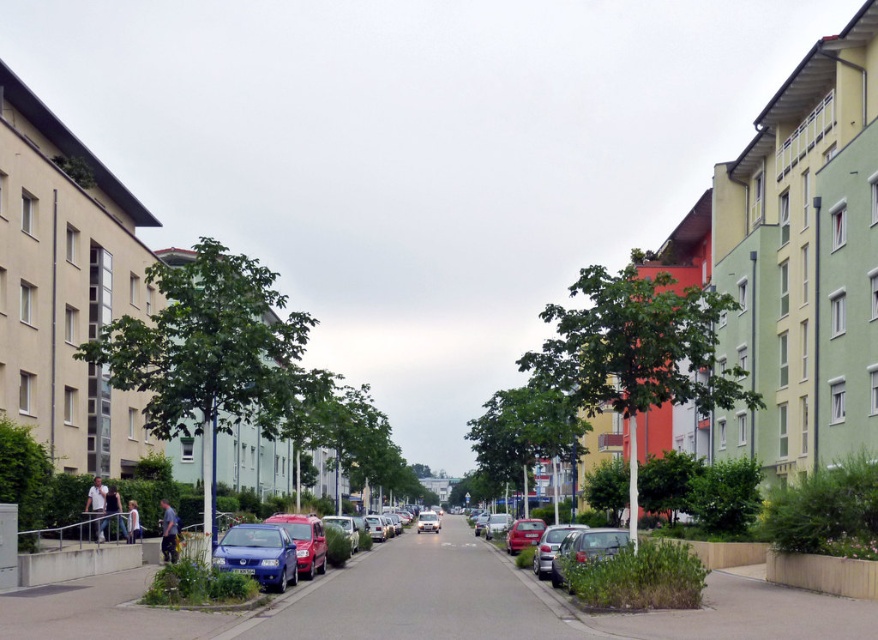
You are a delivery driver who needs to park your vehicle on the street. You see the matte blue sedan at center and the matte silver sedan at lower right. Which vehicle is closer to the curb on the left side of the street?

The matte blue sedan at center is closer to the curb on the left side of the street because it is positioned to the left of the matte silver sedan at lower right.

You are a delivery person trying to park your 1.2 meter wide cart between the shiny blue sedan at lower left and the metallic blue car at center. Can your cart fit through the space between them?

The shiny blue sedan at lower left is thinner than the metallic blue car at center. Since the sedan is thinner, the space between them might be wider than 1.2 meters. However, without knowing the exact width of the space, it is uncertain if the cart will fit. Please check the actual space before attempting to park.